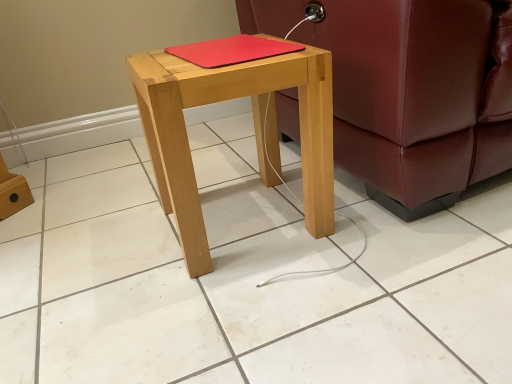
Question: Can you confirm if leather couch at right is bigger than natural wood stool at center?

Choices:
 (A) no
 (B) yes

Answer: (B)

Question: Is leather couch at right next to natural wood stool at center and touching it?

Choices:
 (A) yes
 (B) no

Answer: (B)

Question: From the image's perspective, is leather couch at right over natural wood stool at center?

Choices:
 (A) no
 (B) yes

Answer: (B)

Question: Is leather couch at right positioned behind natural wood stool at center?

Choices:
 (A) yes
 (B) no

Answer: (B)

Question: Could you tell me if leather couch at right is turned towards natural wood stool at center?

Choices:
 (A) yes
 (B) no

Answer: (B)

Question: Visually, is natural wood stool at center positioned to the left or to the right of red matte notebook at center?

Choices:
 (A) left
 (B) right

Answer: (A)

Question: Would you say natural wood stool at center is inside or outside red matte notebook at center?

Choices:
 (A) inside
 (B) outside

Answer: (B)

Question: Is natural wood stool at center bigger or smaller than red matte notebook at center?

Choices:
 (A) big
 (B) small

Answer: (A)

Question: From a real-world perspective, is natural wood stool at center physically located above or below red matte notebook at center?

Choices:
 (A) below
 (B) above

Answer: (A)

Question: Is point (256, 44) closer or farther from the camera than point (358, 145)?

Choices:
 (A) closer
 (B) farther

Answer: (A)

Question: In terms of height, does red matte notebook at center look taller or shorter compared to leather couch at right?

Choices:
 (A) short
 (B) tall

Answer: (A)

Question: In terms of width, does red matte notebook at center look wider or thinner when compared to leather couch at right?

Choices:
 (A) thin
 (B) wide

Answer: (A)

Question: From a real-world perspective, is red matte notebook at center above or below leather couch at right?

Choices:
 (A) above
 (B) below

Answer: (A)

Question: From the image's perspective, relative to natural wood stool at center, is leather couch at right above or below?

Choices:
 (A) above
 (B) below

Answer: (A)

Question: Visually, is leather couch at right positioned to the left or to the right of natural wood stool at center?

Choices:
 (A) left
 (B) right

Answer: (B)